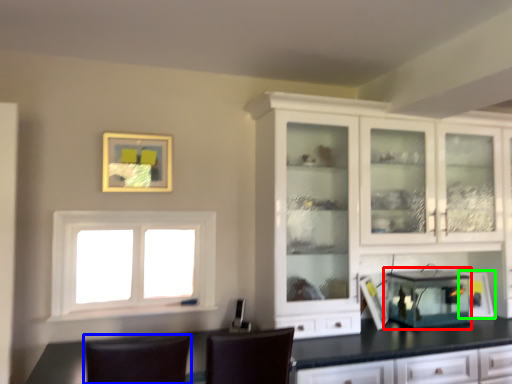
Question: Which is nearer to the appliance (highlighted by a red box)? chair (highlighted by a blue box) or appliance (highlighted by a green box).

Choices:
 (A) chair
 (B) appliance

Answer: (B)